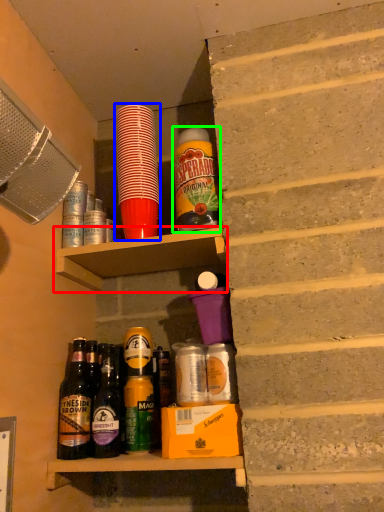
Question: Considering the real-world distances, which object is farthest from shelf (highlighted by a red box)? bottle (highlighted by a blue box) or bottle (highlighted by a green box)?

Choices:
 (A) bottle
 (B) bottle

Answer: (B)